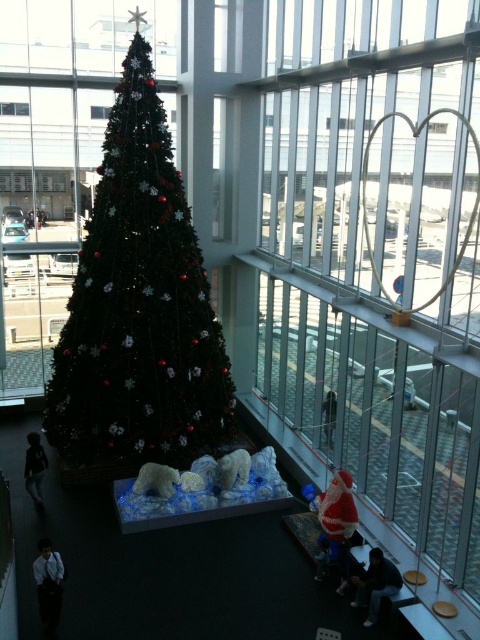
Can you confirm if fluffy white bear at center is positioned to the left of dark gray fabric person at center?

Yes, fluffy white bear at center is to the left of dark gray fabric person at center.

Is the position of fluffy white bear at center more distant than that of dark gray fabric person at center?

No, it is not.

What do you see at coordinates (156, 480) in the screenshot? I see `fluffy white bear at center` at bounding box center [156, 480].

In order to click on fluffy white bear at center in this screenshot , I will do `click(156, 480)`.

Is red velvet santa hat at lower right thinner than fluffy white bear at center?

Yes.

Can you confirm if red velvet santa hat at lower right is positioned above fluffy white bear at center?

No.

The image size is (480, 640). What are the coordinates of `red velvet santa hat at lower right` in the screenshot? It's located at (337, 508).

From the picture: Can you confirm if red velvet santa hat at lower right is positioned to the right of dark gray sweater at lower left?

Indeed, red velvet santa hat at lower right is positioned on the right side of dark gray sweater at lower left.

Is red velvet santa hat at lower right below dark gray sweater at lower left?

Correct, red velvet santa hat at lower right is located below dark gray sweater at lower left.

Locate an element on the screen. The image size is (480, 640). red velvet santa hat at lower right is located at coordinates (337, 508).

You are a GUI agent. You are given a task and a screenshot of the screen. Output one action in this format:
    pyautogui.click(x=<x>, y=<y>)
    Task: Click on the red velvet santa hat at lower right
    
    Given the screenshot: What is the action you would take?
    pyautogui.click(x=337, y=508)